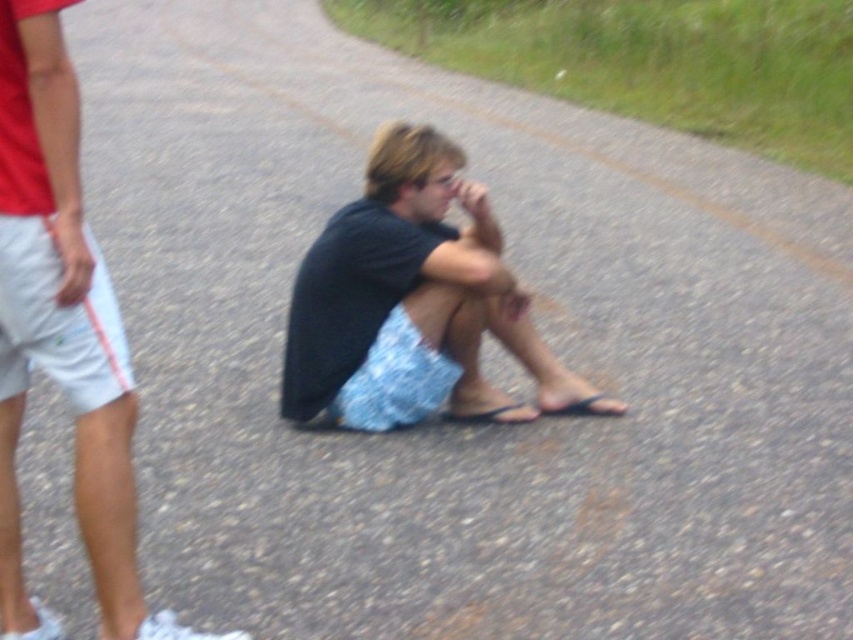
Question: Which object is farther from the camera taking this photo?

Choices:
 (A) dark gray fabric shorts at center
 (B) matte black shirt at center

Answer: (A)

Question: Does matte black shirt at center lie behind dark gray fabric shorts at center?

Choices:
 (A) no
 (B) yes

Answer: (A)

Question: Can you confirm if matte black shirt at center is positioned to the right of dark gray fabric shorts at center?

Choices:
 (A) no
 (B) yes

Answer: (A)

Question: Does matte black shirt at center have a lesser width compared to dark gray fabric shorts at center?

Choices:
 (A) no
 (B) yes

Answer: (B)

Question: Which point is farther to the camera?

Choices:
 (A) matte black shirt at center
 (B) dark gray fabric shorts at center

Answer: (B)